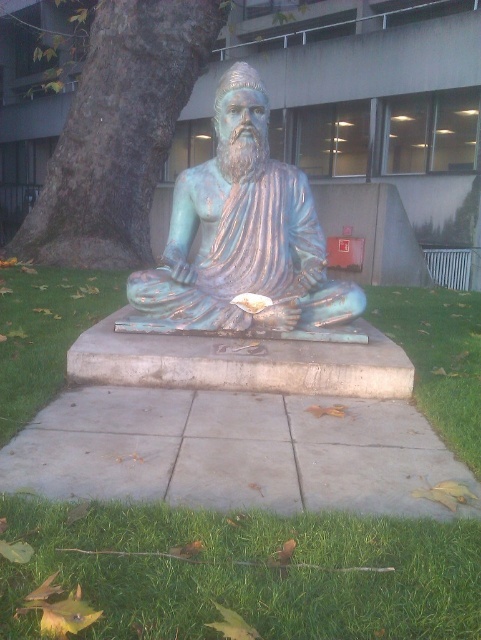
Question: Which point is closer to the camera?

Choices:
 (A) (427, 360)
 (B) (119, 93)
 (C) (300, 182)
 (D) (282, 582)

Answer: (D)

Question: Can you confirm if green patina statue at center is positioned to the left of green grass at lower right?

Choices:
 (A) no
 (B) yes

Answer: (B)

Question: Is green rough bark at left wider than green grass at lower right?

Choices:
 (A) no
 (B) yes

Answer: (B)

Question: Is the position of green grass at lower center more distant than that of green rough bark at left?

Choices:
 (A) yes
 (B) no

Answer: (B)

Question: Among these points, which one is nearest to the camera?

Choices:
 (A) (118, 561)
 (B) (427, 378)
 (C) (278, 237)
 (D) (41, 204)

Answer: (A)

Question: Which point is farther to the camera?

Choices:
 (A) green grass at lower right
 (B) green rough bark at left
 (C) green patina statue at center
 (D) green grass at lower center

Answer: (B)